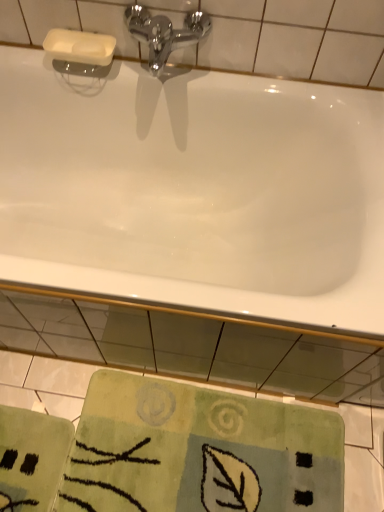
Identify the location of blank space situated above green textured rug at lower center (from a real-world perspective). (212, 451).